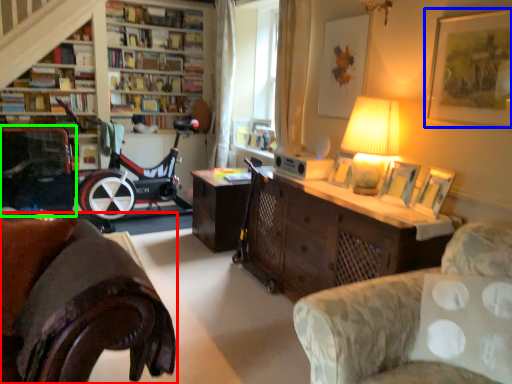
Question: Which object is the closest to the studio couch (highlighted by a red box)? Choose among these: picture frame (highlighted by a blue box) or armchair (highlighted by a green box).

Choices:
 (A) picture frame
 (B) armchair

Answer: (A)